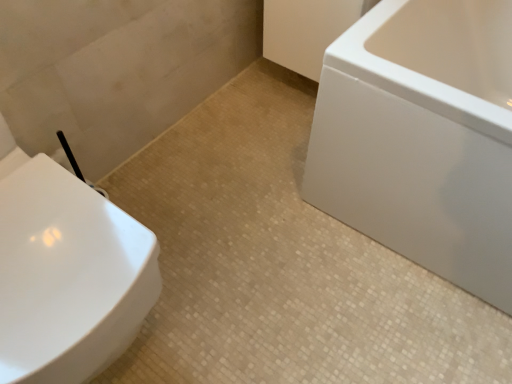
You are a GUI agent. You are given a task and a screenshot of the screen. Output one action in this format:
    pyautogui.click(x=<x>, y=<y>)
    Task: Click on the free space behind white glossy toilet at left
    The image size is (512, 384).
    Given the screenshot: What is the action you would take?
    click(x=173, y=184)